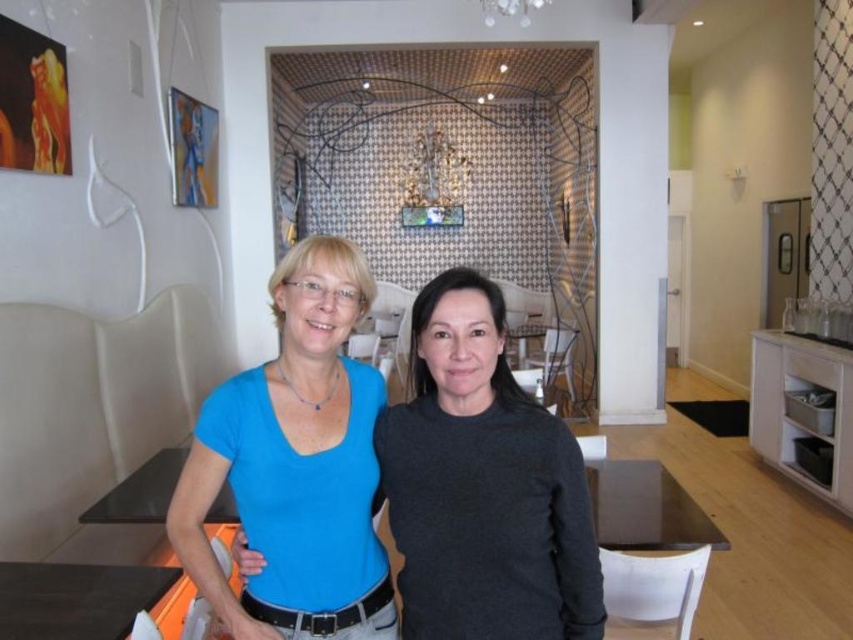
You are planning to take a photo of the matte blue shirt at center and the dark wood table at lower left. Which object should you focus on first if you want to capture both in a single frame without moving the camera? Explain your reasoning based on their sizes.

The matte blue shirt at center should be focused on first because it has a larger size compared to the dark wood table at lower left, making it more prominent in the frame.

You are a delivery person who needs to place a package on the dark wood table at lower left. However, there is a dark gray sweater at center in the way. Can you move the sweater to make space?

The dark gray sweater at center is above the dark wood table at lower left, so moving the sweater would allow you to place the package on the table.